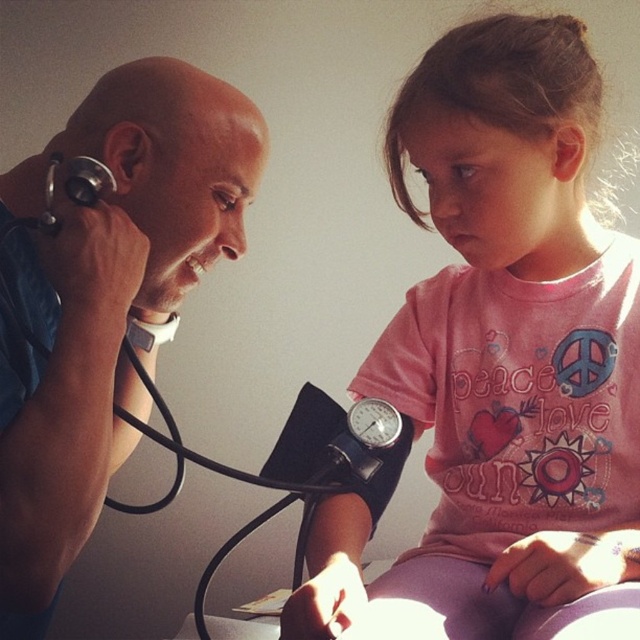
You are a nurse in the room. You need to place both the pink fabric shirt at upper right and the blue fabric stethoscope at left into a small medical bag that can only hold items narrower than the stethoscope. Which item can you place in the bag?

The blue fabric stethoscope at left can be placed in the bag since its width is smaller than the pink fabric shirt at upper right, and the bag can only hold items narrower than the stethoscope.

What is located at the coordinates point (500, 364) in the image?

The pink fabric shirt at upper right is located at point (500, 364).